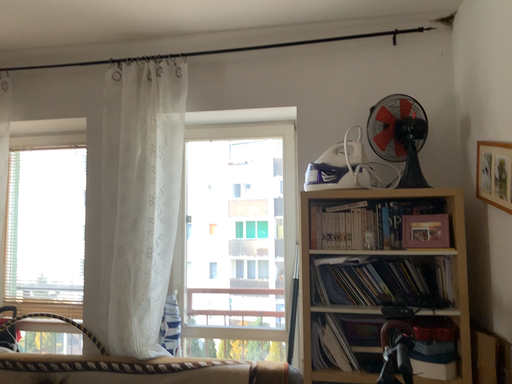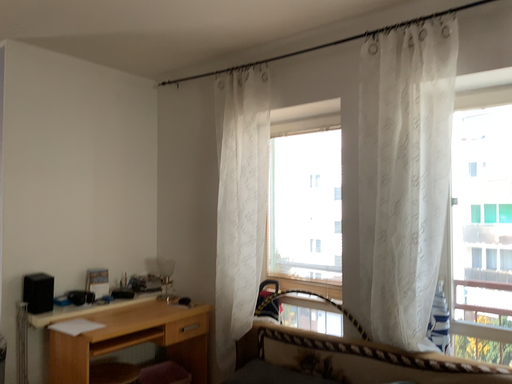
Question: Which way did the camera rotate in the video?

Choices:
 (A) rotated right
 (B) rotated left

Answer: (B)